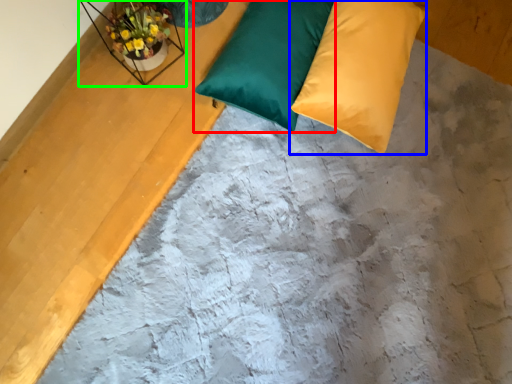
Question: Which is farther away from pillow (highlighted by a red box)? pillow (highlighted by a blue box) or window sill (highlighted by a green box)?

Choices:
 (A) pillow
 (B) window sill

Answer: (B)